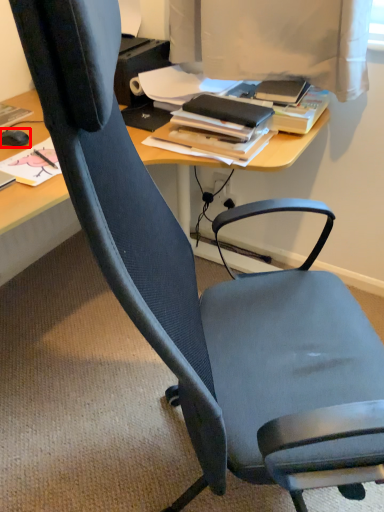
Question: Observing the image, what is the correct spatial positioning of mouse (annotated by the red box) in reference to book?

Choices:
 (A) left
 (B) right

Answer: (A)